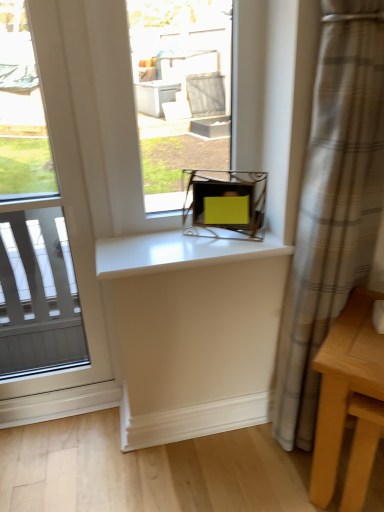
You are a GUI agent. You are given a task and a screenshot of the screen. Output one action in this format:
    pyautogui.click(x=<x>, y=<y>)
    Task: Click on the vacant space that is to the left of plaid fabric curtain at right
    This screenshot has height=512, width=384.
    Given the screenshot: What is the action you would take?
    pyautogui.click(x=232, y=462)